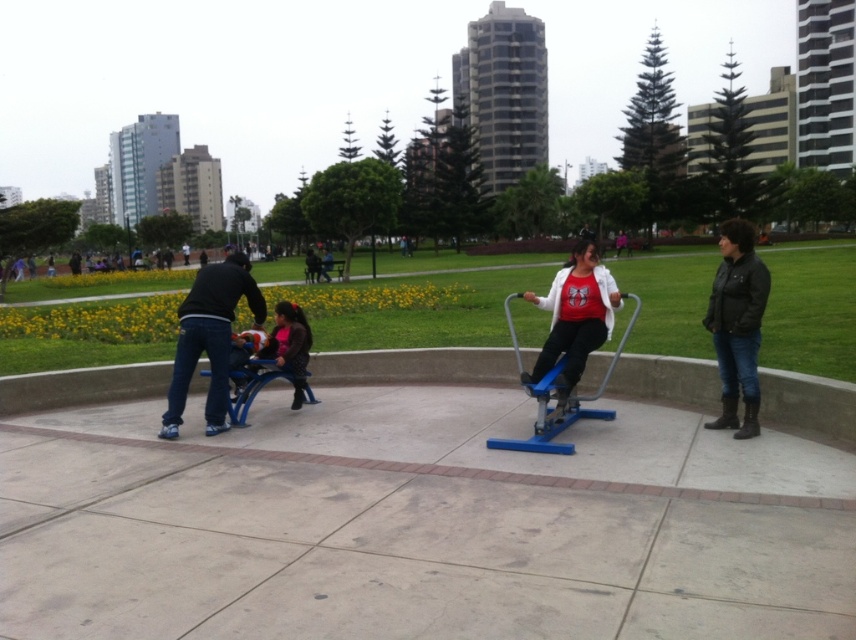
Does point (755, 316) come behind point (605, 417)?

No, it is in front of (605, 417).

What do you see at coordinates (736, 324) in the screenshot? I see `black leather jacket at lower right` at bounding box center [736, 324].

Locate an element on the screen. black leather jacket at lower right is located at coordinates pyautogui.click(x=736, y=324).

Between point (56, 605) and point (298, 336), which one is positioned in front?

Point (56, 605) is in front.

Does concrete at center lie in front of dark brown leather jacket at center?

Yes, it is.

Identify the location of concrete at center. The height and width of the screenshot is (640, 856). (418, 525).

Does concrete at center lie in front of dark blue jeans at left?

That is True.

Can you confirm if concrete at center is shorter than dark blue jeans at left?

Yes, concrete at center is shorter than dark blue jeans at left.

Does point (15, 435) come behind point (223, 342)?

That is True.

The image size is (856, 640). Identify the location of concrete at center. (418, 525).